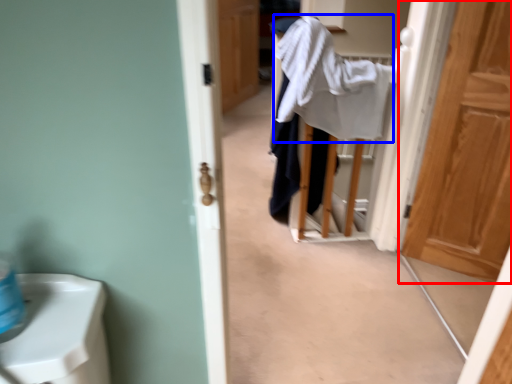
Question: Which point is closer to the camera, door (highlighted by a red box) or bath towel (highlighted by a blue box)?

Choices:
 (A) door
 (B) bath towel

Answer: (A)